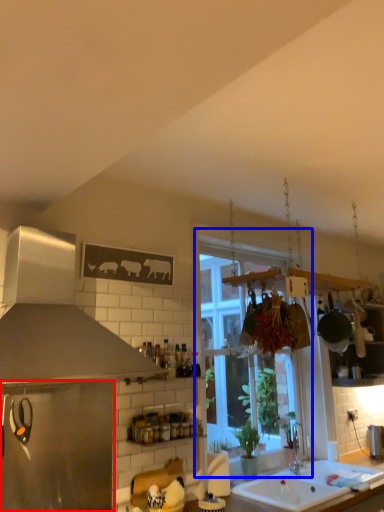
Question: Which object appears farthest to the camera in this image, appliance (highlighted by a red box) or window (highlighted by a blue box)?

Choices:
 (A) appliance
 (B) window

Answer: (B)